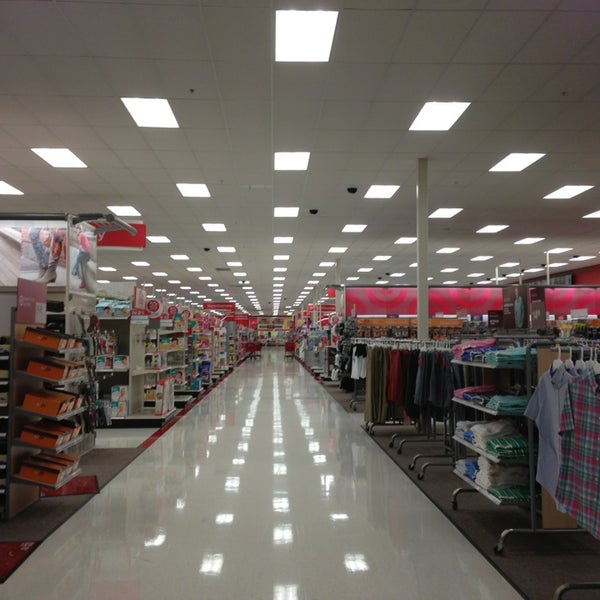
Identify the location of pants rack. This screenshot has height=600, width=600. (409, 352).